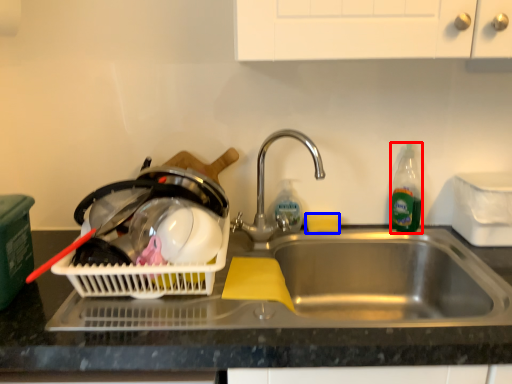
Question: Which object appears closest to the camera in this image, bottle (highlighted by a red box) or food (highlighted by a blue box)?

Choices:
 (A) bottle
 (B) food

Answer: (A)